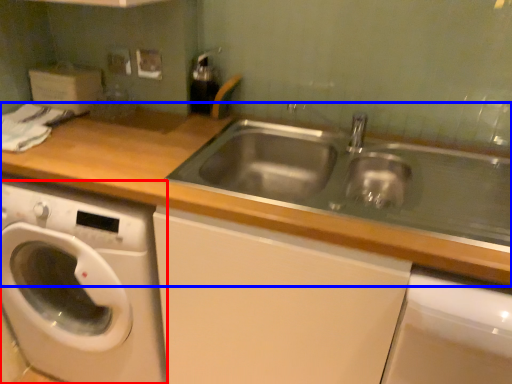
Question: Which of the following is the farthest to the observer, washing machine (highlighted by a red box) or countertop (highlighted by a blue box)?

Choices:
 (A) washing machine
 (B) countertop

Answer: (A)